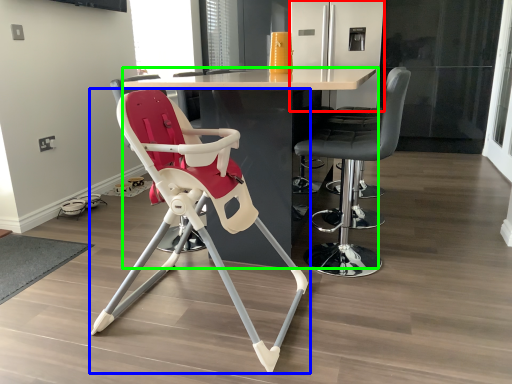
Question: Considering the real-world distances, which object is farthest from screen door (highlighted by a red box)? chair (highlighted by a blue box) or table (highlighted by a green box)?

Choices:
 (A) chair
 (B) table

Answer: (A)